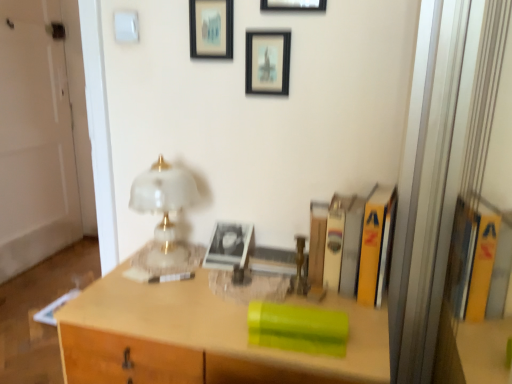
Question: Which direction should I rotate to look at green plastic container at center, marked as the 3th book in a right-to-left arrangement, — up or down?

Choices:
 (A) up
 (B) down

Answer: (B)

Question: Considering the relative sizes of hardcover book at center, the second book positioned from the left, and green plastic container at center in the image provided, is hardcover book at center, the second book positioned from the left, smaller than green plastic container at center?

Choices:
 (A) no
 (B) yes

Answer: (B)

Question: Does hardcover book at center, the 2th book in the right-to-left sequence, have a greater height compared to green plastic container at center?

Choices:
 (A) yes
 (B) no

Answer: (B)

Question: Considering the relative sizes of hardcover book at center, the 2th book in the right-to-left sequence, and green plastic container at center in the image provided, is hardcover book at center, the 2th book in the right-to-left sequence, thinner than green plastic container at center?

Choices:
 (A) no
 (B) yes

Answer: (B)

Question: From a real-world perspective, is hardcover book at center, the 2th book in the right-to-left sequence, beneath green plastic container at center?

Choices:
 (A) no
 (B) yes

Answer: (A)

Question: Would you consider hardcover book at center, the 2th book in the right-to-left sequence, to be distant from green plastic container at center?

Choices:
 (A) yes
 (B) no

Answer: (B)

Question: Would you say green plastic container at center is part of hardcover book at center, the 2th book in the right-to-left sequence,'s contents?

Choices:
 (A) yes
 (B) no

Answer: (B)

Question: Does wooden picture frame at upper center, which is counted as the first picture frame, starting from the right, lie in front of matte black picture frame at upper center, the second picture frame viewed from the left?

Choices:
 (A) yes
 (B) no

Answer: (A)

Question: Is the position of wooden picture frame at upper center, which is counted as the first picture frame, starting from the right, more distant than that of matte black picture frame at upper center, the second picture frame viewed from the left?

Choices:
 (A) yes
 (B) no

Answer: (B)

Question: Are wooden picture frame at upper center, which appears as the 3th picture frame when viewed from the left, and matte black picture frame at upper center, the second picture frame viewed from the left, beside each other?

Choices:
 (A) no
 (B) yes

Answer: (A)

Question: Is wooden picture frame at upper center, which appears as the 3th picture frame when viewed from the left, at the left side of matte black picture frame at upper center, the second picture frame viewed from the left?

Choices:
 (A) no
 (B) yes

Answer: (A)

Question: Is wooden picture frame at upper center, which is counted as the first picture frame, starting from the right, far away from matte black picture frame at upper center, the 2th picture frame in the right-to-left sequence?

Choices:
 (A) yes
 (B) no

Answer: (B)

Question: From the image's perspective, is wooden picture frame at upper center, which is counted as the first picture frame, starting from the right, located beneath matte black picture frame at upper center, the second picture frame viewed from the left?

Choices:
 (A) no
 (B) yes

Answer: (A)

Question: Is hardcover book at center, the second book positioned from the left, outside of white glossy door at left?

Choices:
 (A) no
 (B) yes

Answer: (B)